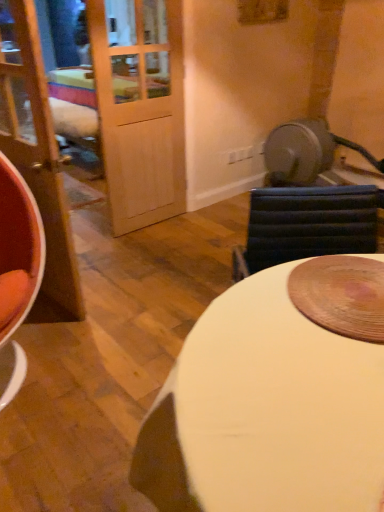
Locate an element on the screen. This screenshot has width=384, height=512. vacant area that lies to the right of matte wood door at left is located at coordinates (131, 304).